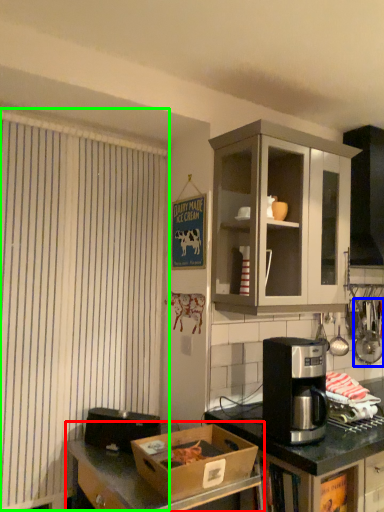
Question: Which object is the farthest from desk (highlighted by a red box)? Choose among these: appliance (highlighted by a blue box) or curtain (highlighted by a green box).

Choices:
 (A) appliance
 (B) curtain

Answer: (A)